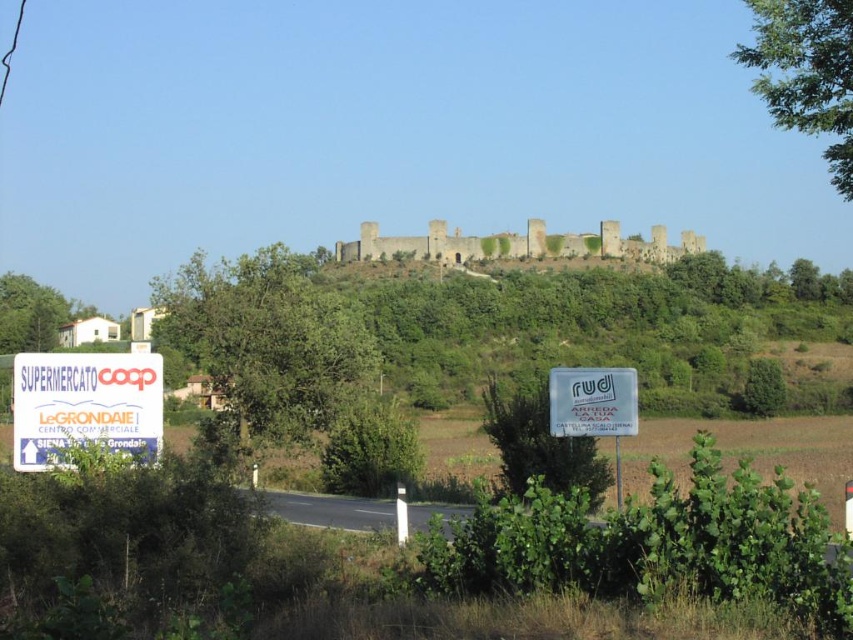
Which is above, white plastic sign at lower left or stone wall at upper center?

stone wall at upper center

How far apart are white plastic sign at lower left and stone wall at upper center?

A distance of 92.11 meters exists between white plastic sign at lower left and stone wall at upper center.

Find the location of a particular element. This screenshot has width=853, height=640. white plastic sign at lower left is located at coordinates (85, 404).

Who is taller, stone wall at upper center or white plastic sign at center-right?

stone wall at upper center is taller.

Between point (570, 256) and point (593, 396), which one is positioned behind?

Positioned behind is point (570, 256).

Who is more distant from viewer, [440,225] or [585,408]?

The point [440,225] is behind.

At what (x,y) coordinates should I click in order to perform the action: click on stone wall at upper center. Please return your answer as a coordinate pair (x, y). The image size is (853, 640). Looking at the image, I should click on (515, 244).

Between point (50, 436) and point (625, 376), which one is positioned in front?

Point (50, 436) is more forward.

Does white plastic sign at lower left have a greater width compared to white plastic sign at center-right?

Yes, white plastic sign at lower left is wider than white plastic sign at center-right.

Image resolution: width=853 pixels, height=640 pixels. Identify the location of white plastic sign at lower left. (85, 404).

The height and width of the screenshot is (640, 853). I want to click on white plastic sign at lower left, so click(x=85, y=404).